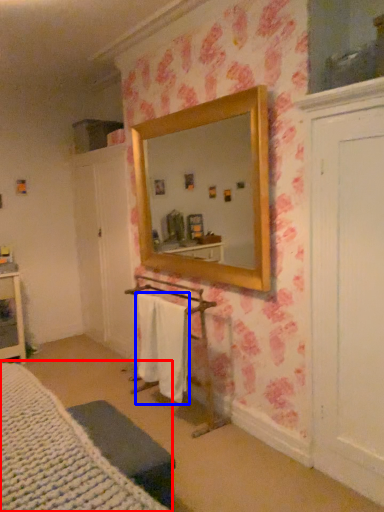
Question: Which point is further to the camera, bed (highlighted by a red box) or bath towel (highlighted by a blue box)?

Choices:
 (A) bed
 (B) bath towel

Answer: (B)